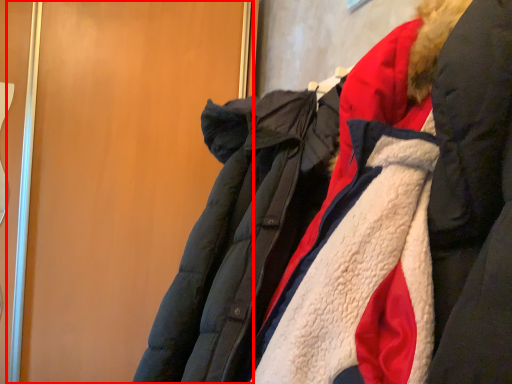
Question: Considering the relative positions of door (annotated by the red box) and jacket in the image provided, where is door (annotated by the red box) located with respect to the staircase?

Choices:
 (A) right
 (B) left

Answer: (B)